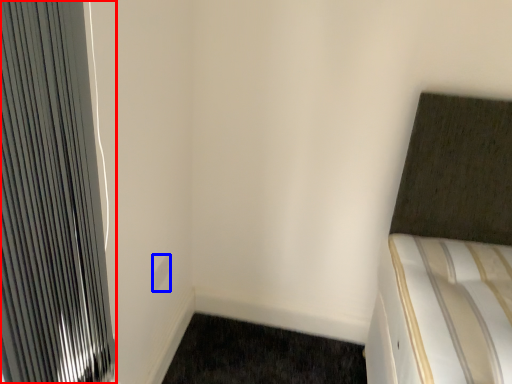
Question: Which object is further to the camera taking this photo, radiator (highlighted by a red box) or electric outlet (highlighted by a blue box)?

Choices:
 (A) radiator
 (B) electric outlet

Answer: (B)